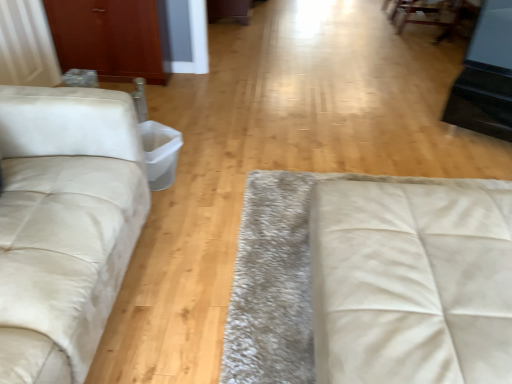
Question: Is white leather studio couch at center, placed as the first studio couch when sorted from right to left, turned away from matte wood armoire at upper left?

Choices:
 (A) yes
 (B) no

Answer: (B)

Question: Can you confirm if white leather studio couch at center, acting as the second studio couch starting from the left, is positioned to the right of matte wood armoire at upper left?

Choices:
 (A) no
 (B) yes

Answer: (B)

Question: Is white leather studio couch at center, acting as the second studio couch starting from the left, closer to the viewer compared to matte wood armoire at upper left?

Choices:
 (A) no
 (B) yes

Answer: (B)

Question: Is matte wood armoire at upper left completely or partially inside white leather studio couch at center, placed as the first studio couch when sorted from right to left?

Choices:
 (A) yes
 (B) no

Answer: (B)

Question: Considering the relative sizes of white leather studio couch at center, acting as the second studio couch starting from the left, and matte wood armoire at upper left in the image provided, is white leather studio couch at center, acting as the second studio couch starting from the left, smaller than matte wood armoire at upper left?

Choices:
 (A) no
 (B) yes

Answer: (A)

Question: Relative to matte wood armoire at upper left, is suede-like beige studio couch at left, acting as the 1th studio couch starting from the left, in front or behind?

Choices:
 (A) front
 (B) behind

Answer: (A)

Question: Considering the positions of point (122, 135) and point (147, 77), is point (122, 135) closer or farther from the camera than point (147, 77)?

Choices:
 (A) closer
 (B) farther

Answer: (A)

Question: From the image's perspective, is suede-like beige studio couch at left, the second studio couch viewed from the right, above or below matte wood armoire at upper left?

Choices:
 (A) above
 (B) below

Answer: (B)

Question: Considering the relative positions of suede-like beige studio couch at left, acting as the 1th studio couch starting from the left, and matte wood armoire at upper left in the image provided, is suede-like beige studio couch at left, acting as the 1th studio couch starting from the left, to the left or to the right of matte wood armoire at upper left?

Choices:
 (A) left
 (B) right

Answer: (B)

Question: In terms of width, does matte wood armoire at upper left look wider or thinner when compared to suede-like beige studio couch at left, the second studio couch viewed from the right?

Choices:
 (A) thin
 (B) wide

Answer: (A)

Question: From their relative heights in the image, would you say matte wood armoire at upper left is taller or shorter than suede-like beige studio couch at left, the second studio couch viewed from the right?

Choices:
 (A) tall
 (B) short

Answer: (B)

Question: Considering the positions of point (91, 46) and point (122, 109), is point (91, 46) closer or farther from the camera than point (122, 109)?

Choices:
 (A) farther
 (B) closer

Answer: (A)

Question: Is matte wood armoire at upper left in front of or behind suede-like beige studio couch at left, the second studio couch viewed from the right, in the image?

Choices:
 (A) behind
 (B) front

Answer: (A)

Question: In terms of height, does suede-like beige studio couch at left, the second studio couch viewed from the right, look taller or shorter compared to white leather studio couch at center, acting as the second studio couch starting from the left?

Choices:
 (A) tall
 (B) short

Answer: (A)

Question: In terms of size, does suede-like beige studio couch at left, the second studio couch viewed from the right, appear bigger or smaller than white leather studio couch at center, acting as the second studio couch starting from the left?

Choices:
 (A) big
 (B) small

Answer: (A)